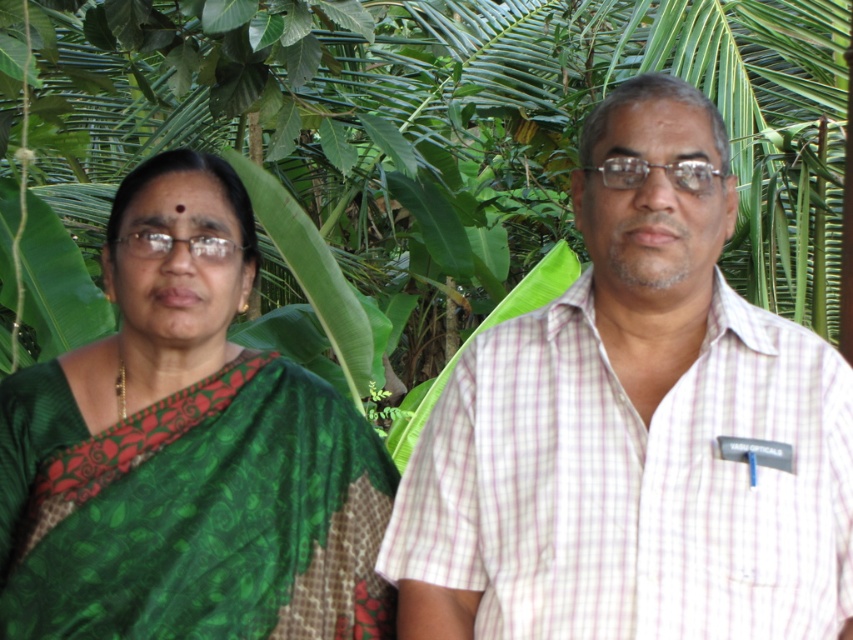
You are a photographer standing 2 meters away from the camera position. You want to take a photo of the scene but need to ensure that the point at coordinates point (613, 538) is in focus. Given your current position, will the point be within the camera focus range?

The point (613, 538) is 1.91 meters from the camera. Since you are standing 2 meters away from the camera position, the distance between you and the point is approximately 0.09 meters. Most cameras have a focus range that can handle this small distance difference, so the point should be within the camera focus range.

You are a photographer trying to position two subjects in a photo. The woman in green saree is at the left and the man in white checkered shirt at right. Based on their positions, which subject is closer to the bottom of the image?

The man in white checkered shirt at right is closer to the bottom of the image because his position at point (631, 428) has a higher y coordinate value, which indicates a lower position on the image plane.

You are a photographer trying to capture a closeup of the white checkered shirt at right. You notice a point marked at coordinates (x=631, y=428). Where exactly on the white checkered shirt at right is this point located?

The point at coordinates (x=631, y=428) is located on the white checkered shirt at right.